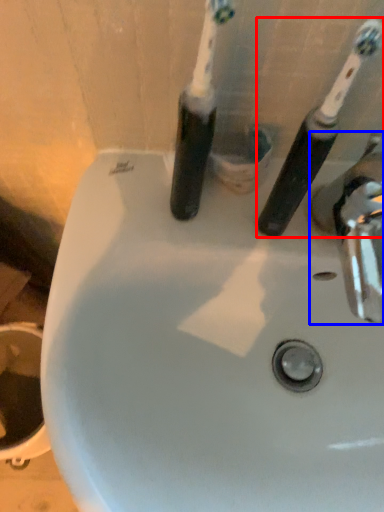
Question: Which point is closer to the camera, toothbrush (highlighted by a red box) or tap (highlighted by a blue box)?

Choices:
 (A) toothbrush
 (B) tap

Answer: (A)